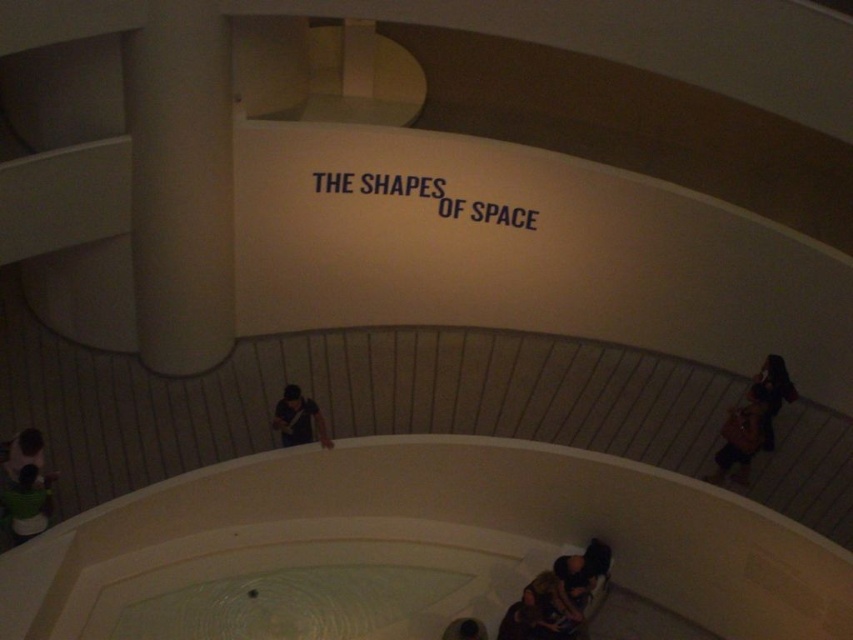
Question: Is brown leather bag at lower right below matte black shirt at center?

Choices:
 (A) yes
 (B) no

Answer: (B)

Question: In this image, where is matte black shirt at center located relative to dark brown leather jacket at lower left?

Choices:
 (A) above
 (B) below

Answer: (A)

Question: Considering the real-world distances, which object is farthest from the green fabric shirt at lower left?

Choices:
 (A) brown leather bag at lower right
 (B) matte black shirt at center
 (C) dark brown leather jacket at lower left

Answer: (A)

Question: Does matte black shirt at center lie in front of dark brown leather jacket at lower left?

Choices:
 (A) no
 (B) yes

Answer: (A)

Question: Among these objects, which one is farthest from the camera?

Choices:
 (A) brown leather bag at lower right
 (B) dark brown leather jacket at lower left
 (C) green fabric shirt at lower left
 (D) matte black shirt at center

Answer: (A)

Question: Which of the following is the closest to the observer?

Choices:
 (A) (33, 518)
 (B) (15, 458)
 (C) (720, 449)
 (D) (291, 426)

Answer: (A)